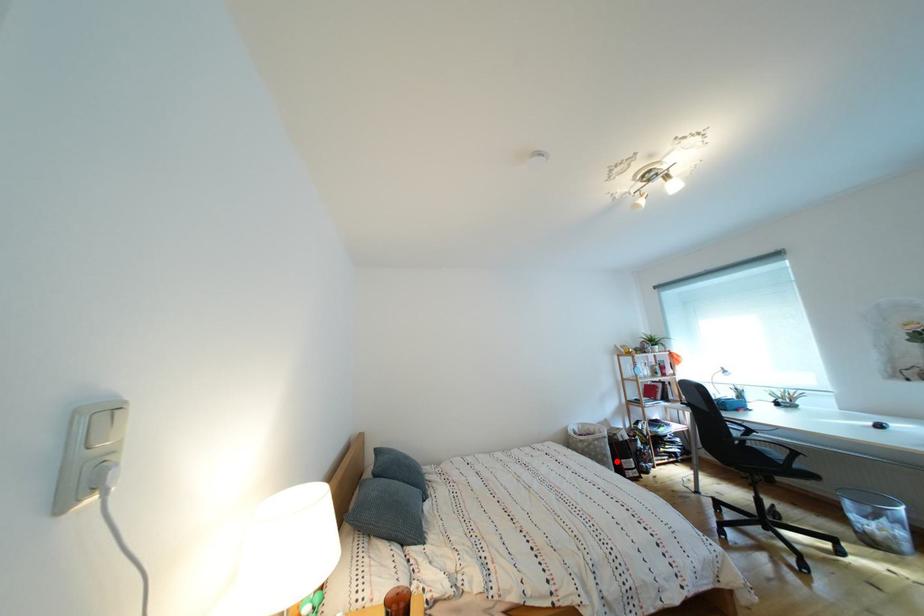
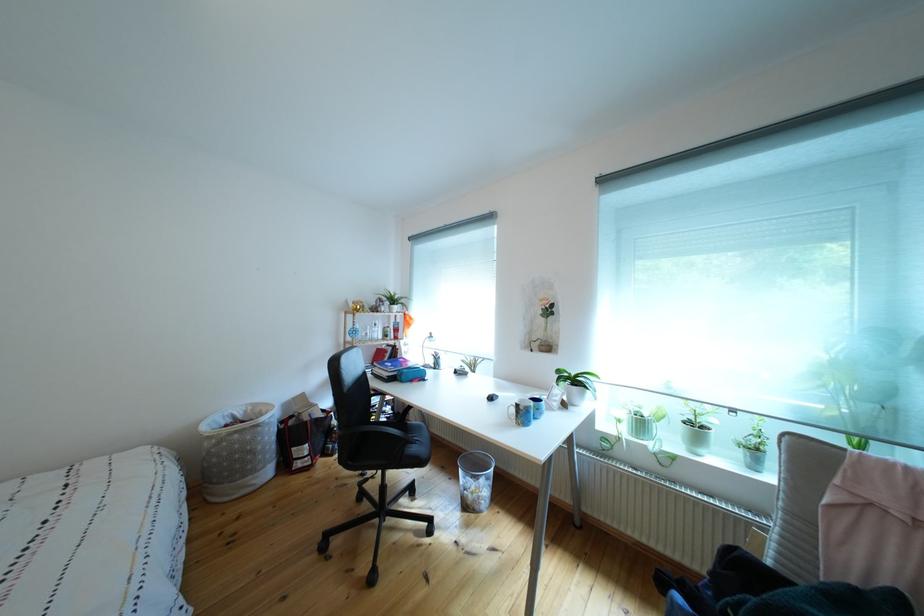
Where in the second image is the point corresponding to the highlighted location from the first image?

(263, 456)